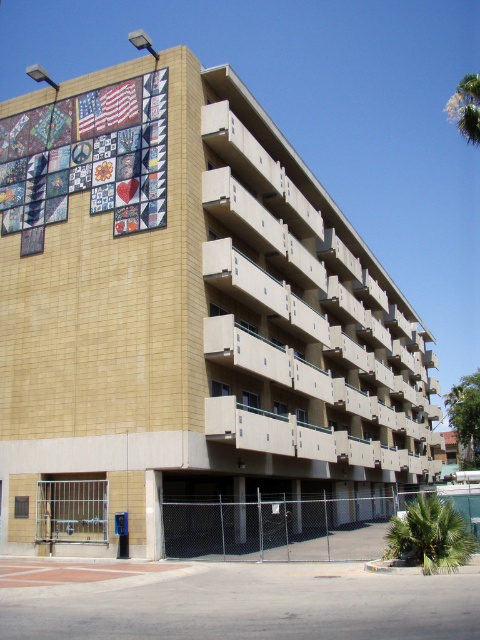
Question: Among these objects, which one is farthest from the camera?

Choices:
 (A) green leafy palm tree at lower right
 (B) green leafy palm tree at upper right

Answer: (B)

Question: Can you confirm if green leafy palm tree at lower right is positioned to the right of green leafy palm tree at upper right?

Choices:
 (A) yes
 (B) no

Answer: (B)

Question: Is green leafy palm tree at lower right wider than green leafy palm tree at upper right?

Choices:
 (A) yes
 (B) no

Answer: (B)

Question: Which object appears farthest from the camera in this image?

Choices:
 (A) green leafy palm tree at lower right
 (B) green leafy palm tree at upper right

Answer: (B)

Question: Is green leafy palm tree at lower right wider than green leafy palm tree at upper right?

Choices:
 (A) no
 (B) yes

Answer: (A)

Question: Which object is closer to the camera taking this photo?

Choices:
 (A) green leafy palm tree at upper right
 (B) green leafy palm tree at lower right

Answer: (B)